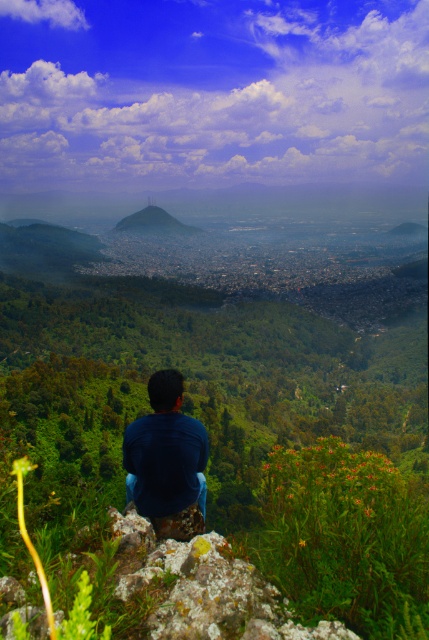
The height and width of the screenshot is (640, 429). What are the coordinates of `dark blue shirt at center` in the screenshot? It's located at (166, 461).

Can you confirm if dark blue shirt at center is taller than green mossy hill at center?

In fact, dark blue shirt at center may be shorter than green mossy hill at center.

Where is `dark blue shirt at center`? dark blue shirt at center is located at coordinates (166, 461).

Find the location of a particular element. The height and width of the screenshot is (640, 429). dark blue shirt at center is located at coordinates (166, 461).